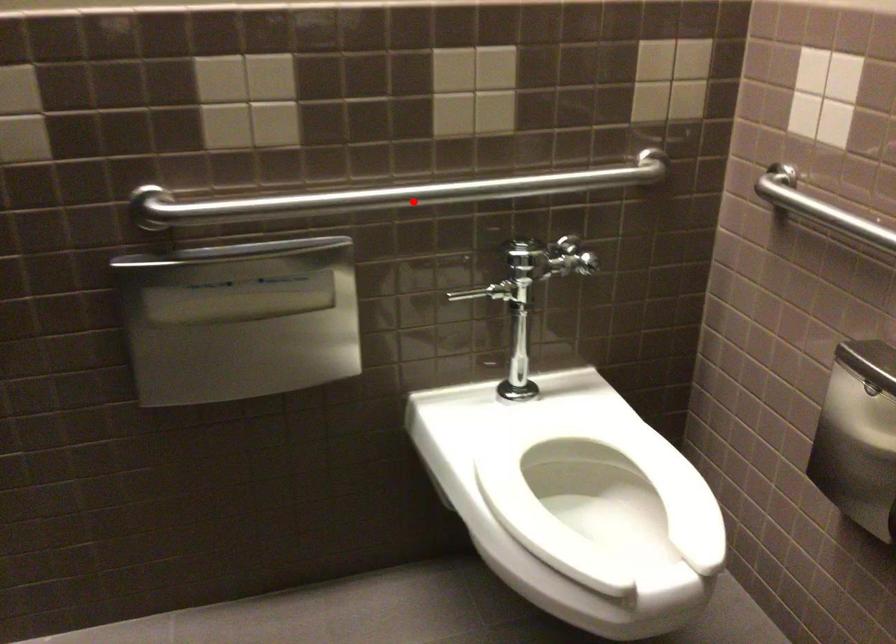
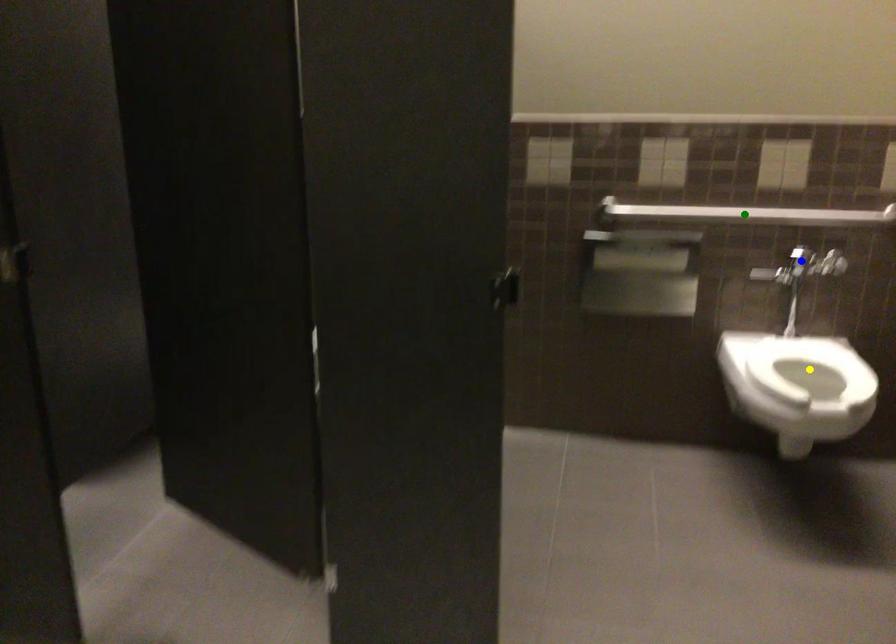
Question: I am providing you with two images of the same scene from different viewpoints. A red point is marked on the first image. You are given multiple points on the second image. Which spot in image 2 lines up with the point in image 1?

Choices:
 (A) green point
 (B) blue point
 (C) yellow point

Answer: (A)